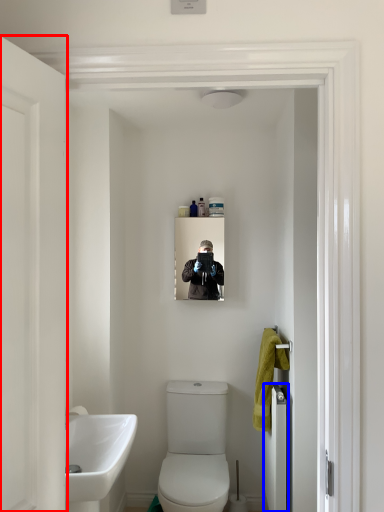
Question: Which point is further to the camera, door (highlighted by a red box) or door (highlighted by a blue box)?

Choices:
 (A) door
 (B) door

Answer: (B)